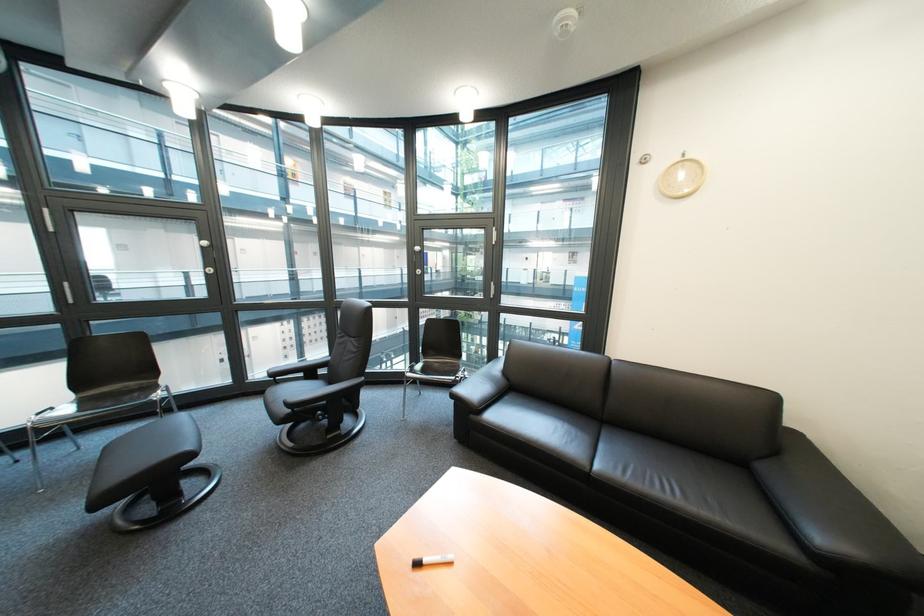
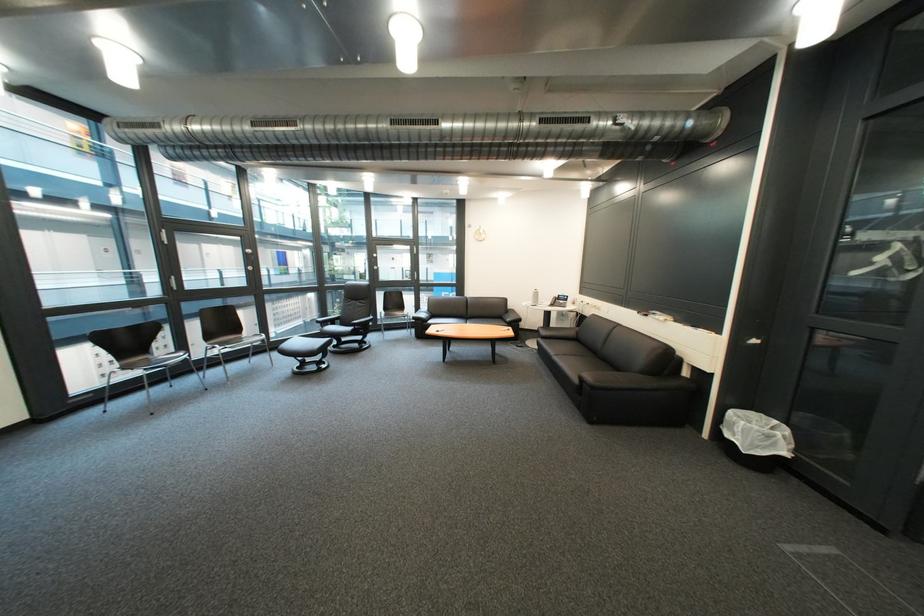
Locate, in the second image, the point that corresponds to point (301, 416) in the first image.

(366, 331)